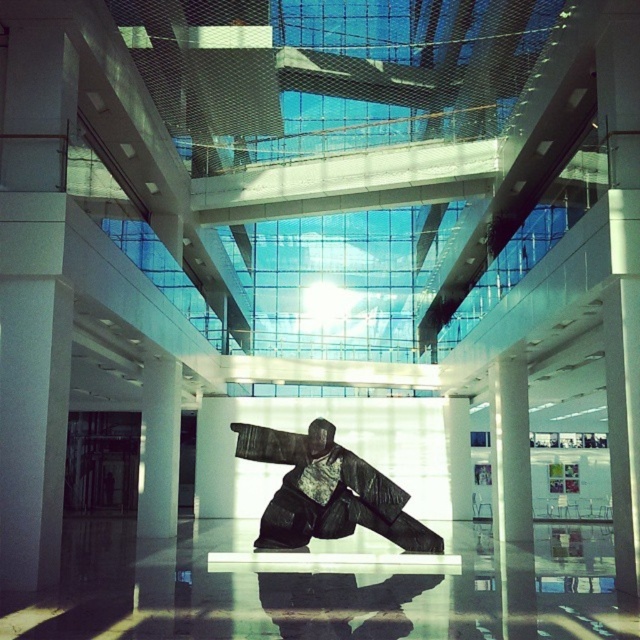
Question: Does dark brown wood statue at center have a lesser width compared to white glossy pillar at center?

Choices:
 (A) no
 (B) yes

Answer: (A)

Question: Does dark brown wood statue at center have a smaller size compared to white glossy pillar at center?

Choices:
 (A) no
 (B) yes

Answer: (B)

Question: Is dark brown wood statue at center positioned in front of white glossy pillar at center?

Choices:
 (A) no
 (B) yes

Answer: (A)

Question: Among these points, which one is farthest from the camera?

Choices:
 (A) (262, 516)
 (B) (502, 410)

Answer: (B)

Question: Which object is closer to the camera taking this photo?

Choices:
 (A) dark brown wood statue at center
 (B) white glossy pillar at center

Answer: (B)